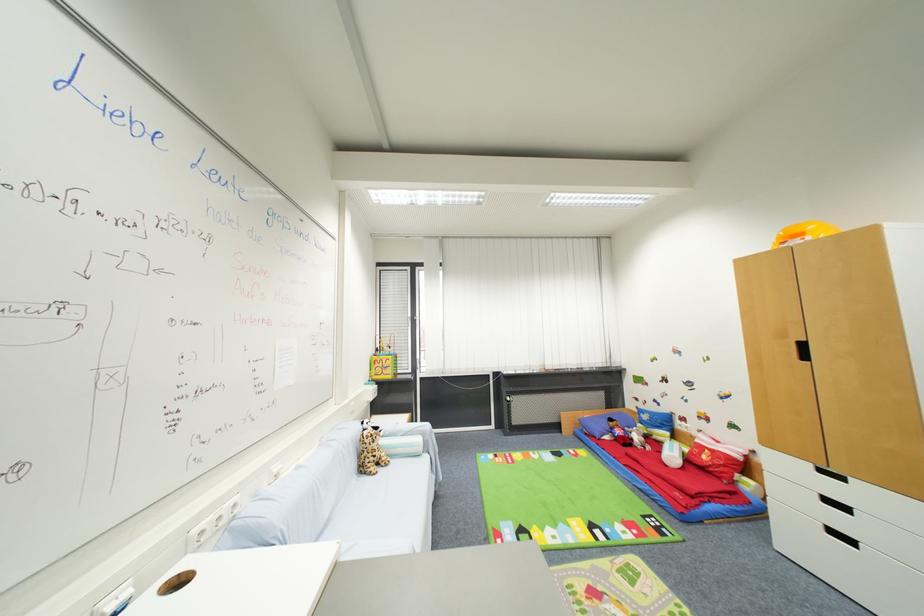
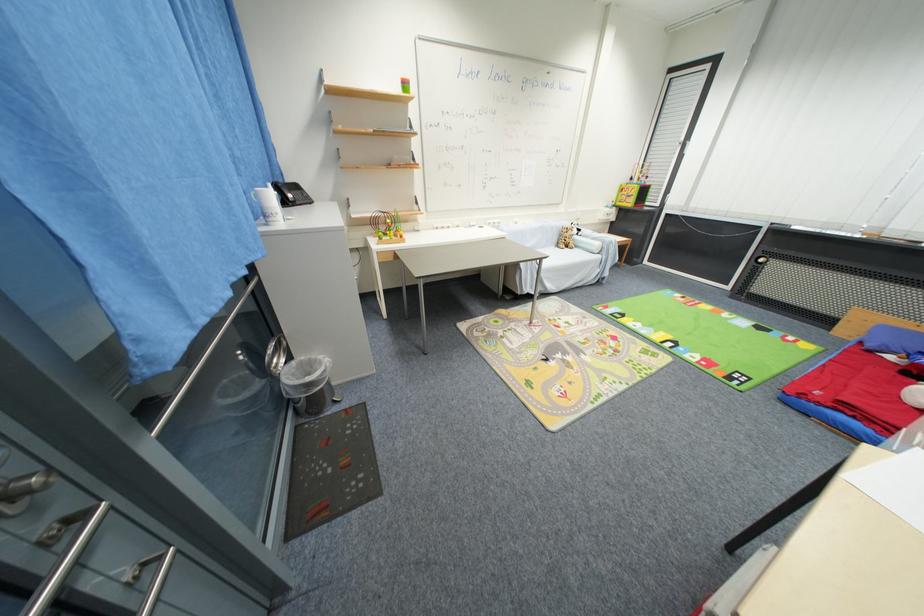
Locate, in the second image, the point that corresponds to (367,472) in the first image.

(563, 246)